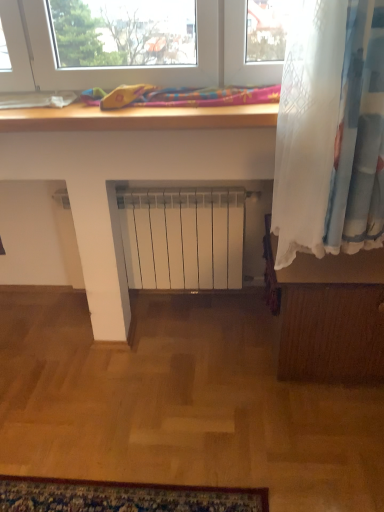
Question: From the image's perspective, is wooden floorboard at right located above or below multicolored fabric at upper center?

Choices:
 (A) below
 (B) above

Answer: (A)

Question: Is wooden floorboard at right spatially inside multicolored fabric at upper center, or outside of it?

Choices:
 (A) outside
 (B) inside

Answer: (A)

Question: In terms of height, does wooden floorboard at right look taller or shorter compared to multicolored fabric at upper center?

Choices:
 (A) short
 (B) tall

Answer: (B)

Question: In terms of size, does multicolored fabric at upper center appear bigger or smaller than wooden floorboard at right?

Choices:
 (A) small
 (B) big

Answer: (A)

Question: Is multicolored fabric at upper center taller or shorter than wooden floorboard at right?

Choices:
 (A) short
 (B) tall

Answer: (A)

Question: Relative to wooden floorboard at right, is multicolored fabric at upper center in front or behind?

Choices:
 (A) behind
 (B) front

Answer: (B)

Question: Is multicolored fabric at upper center wider or thinner than wooden floorboard at right?

Choices:
 (A) wide
 (B) thin

Answer: (B)